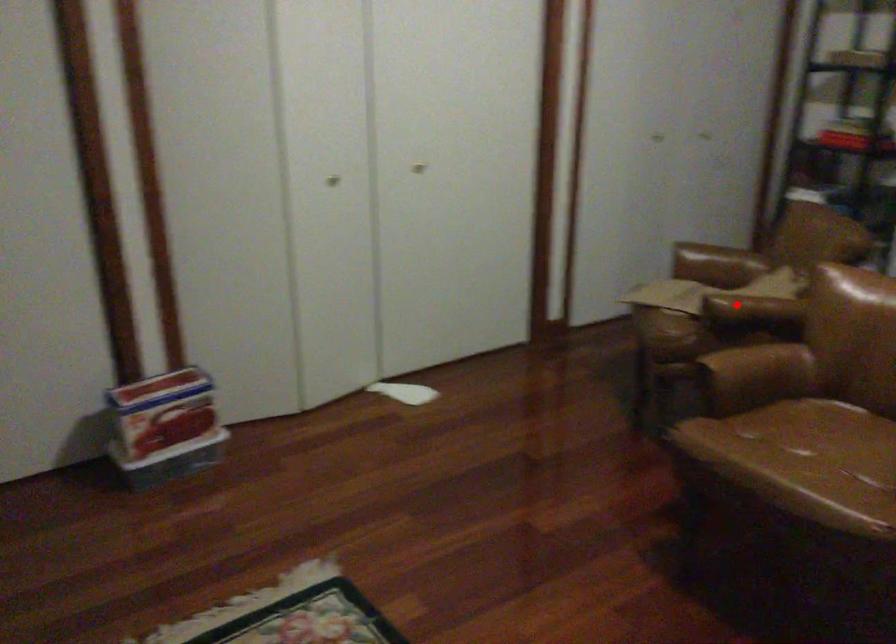
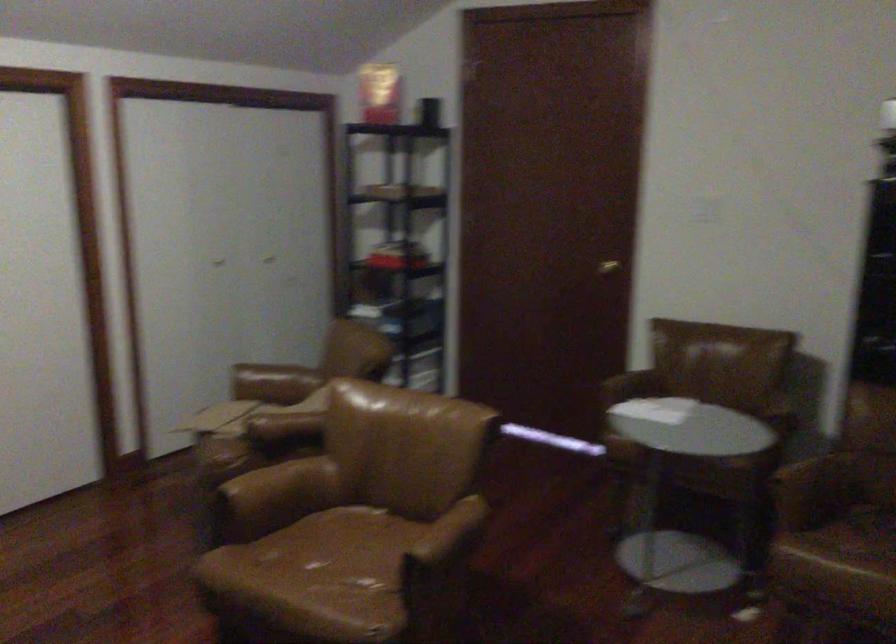
Locate, in the second image, the point that corresponds to the highlighted location in the first image.

(283, 426)